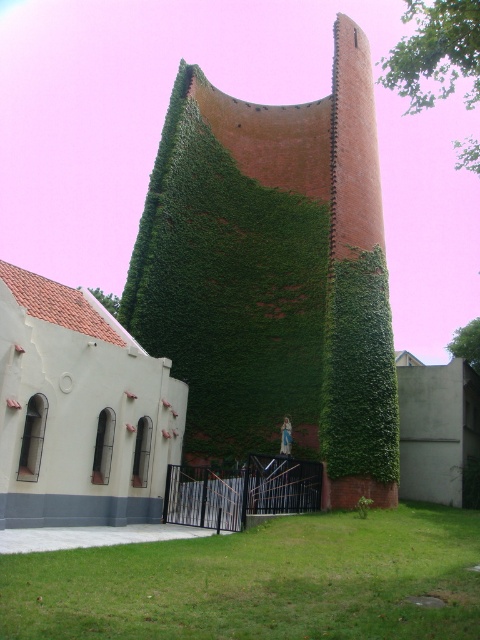
Question: Which point is farther to the camera?

Choices:
 (A) green leafy plant at lower center
 (B) green ivy-covered wall at center

Answer: (B)

Question: Does green ivy-covered wall at center have a greater width compared to green leafy plant at lower center?

Choices:
 (A) yes
 (B) no

Answer: (A)

Question: Is green ivy-covered wall at center bigger than green leafy plant at lower center?

Choices:
 (A) yes
 (B) no

Answer: (A)

Question: Can you confirm if green ivy-covered wall at center is smaller than green leafy plant at lower center?

Choices:
 (A) yes
 (B) no

Answer: (B)